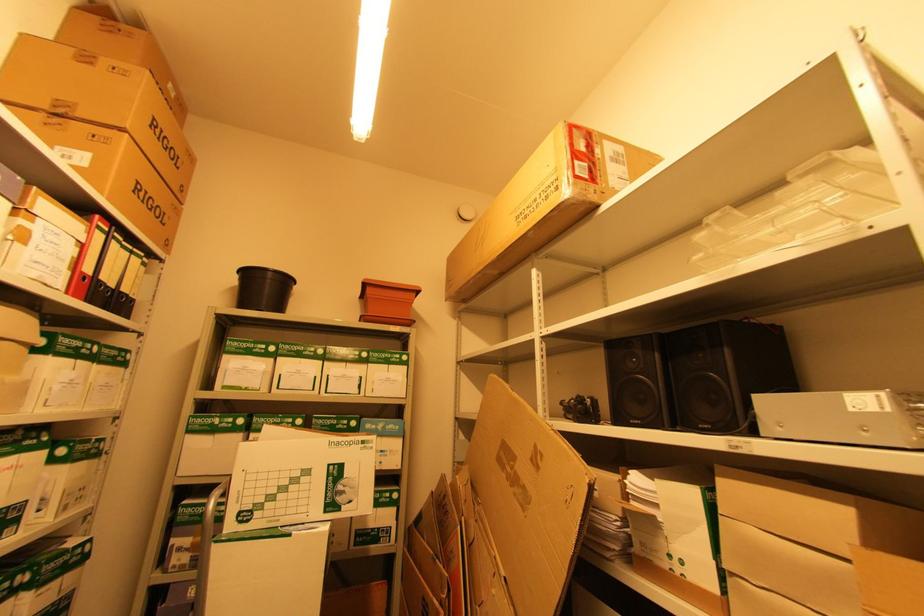
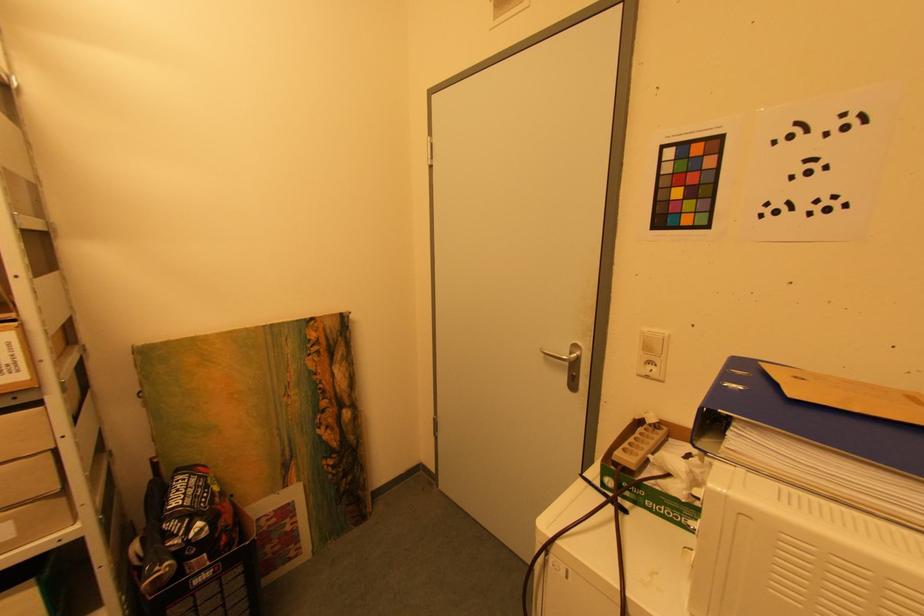
Question: The images are taken continuously from a first-person perspective. In which direction is your viewpoint rotating?

Choices:
 (A) Left
 (B) Right
 (C) Up
 (D) Down

Answer: (B)